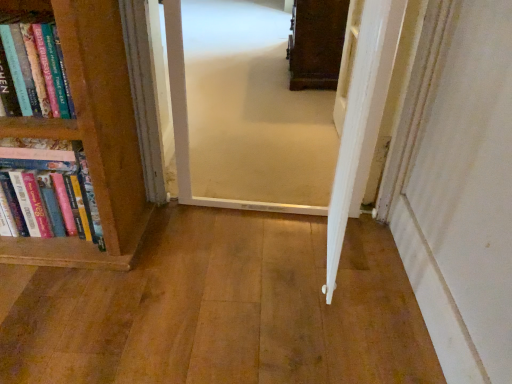
Where is `vacant space underneath hardcover books at left (from a real-world perspective)`? This screenshot has height=384, width=512. vacant space underneath hardcover books at left (from a real-world perspective) is located at coordinates (54, 244).